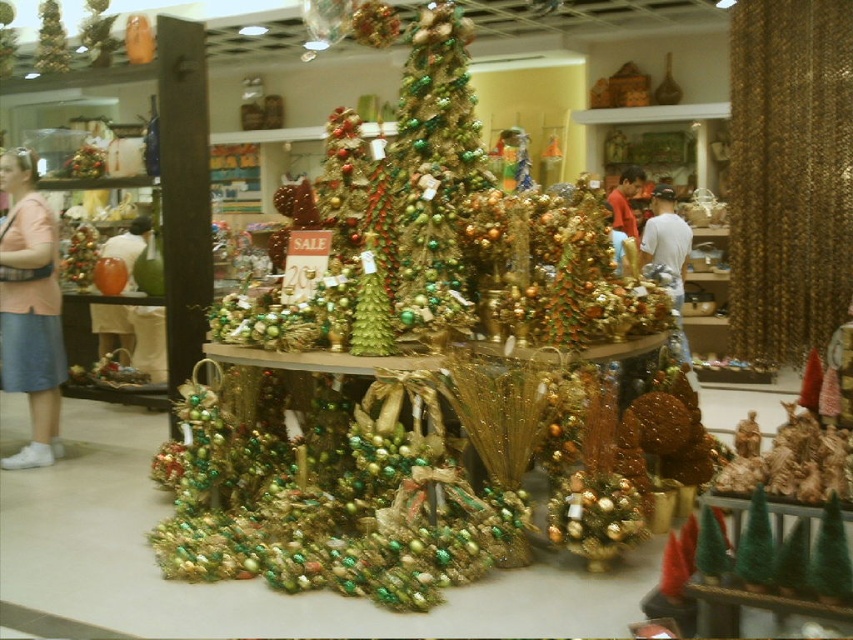
Question: Considering the relative positions of pink fabric skirt at left and white cotton shirt at center in the image provided, where is pink fabric skirt at left located with respect to white cotton shirt at center?

Choices:
 (A) above
 (B) below

Answer: (B)

Question: Which object is closer to the camera taking this photo?

Choices:
 (A) pink fabric skirt at left
 (B) white cotton shirt at center
 (C) green metallic christmas tree at center

Answer: (C)

Question: Is white cotton shirt at center below matte red sweater at center?

Choices:
 (A) no
 (B) yes

Answer: (B)

Question: Is pink fabric skirt at left bigger than matte red sweater at center?

Choices:
 (A) no
 (B) yes

Answer: (B)

Question: Which object appears farthest from the camera in this image?

Choices:
 (A) matte white vase at left
 (B) white cotton shirt at center

Answer: (B)

Question: Estimate the real-world distances between objects in this image. Which object is closer to the matte red sweater at center?

Choices:
 (A) matte white vase at left
 (B) white cotton shirt at center

Answer: (B)